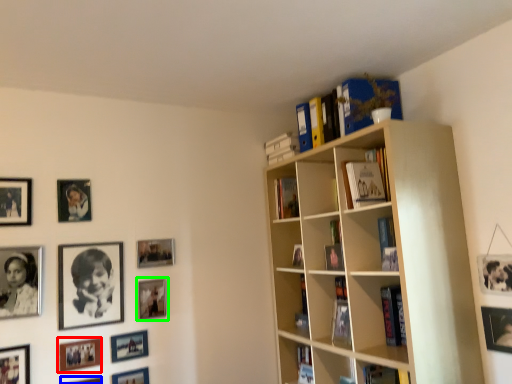
Question: Estimate the real-world distances between objects in this image. Which object is farther from picture frame (highlighted by a red box), picture frame (highlighted by a blue box) or picture frame (highlighted by a green box)?

Choices:
 (A) picture frame
 (B) picture frame

Answer: (B)